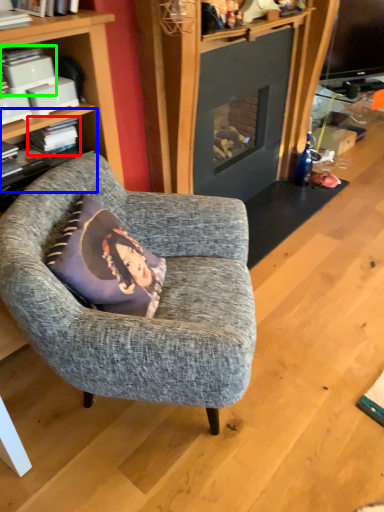
Question: Estimate the real-world distances between objects in this image. Which object is farther from book (highlighted by a red box), shelf (highlighted by a blue box) or book (highlighted by a green box)?

Choices:
 (A) shelf
 (B) book

Answer: (B)